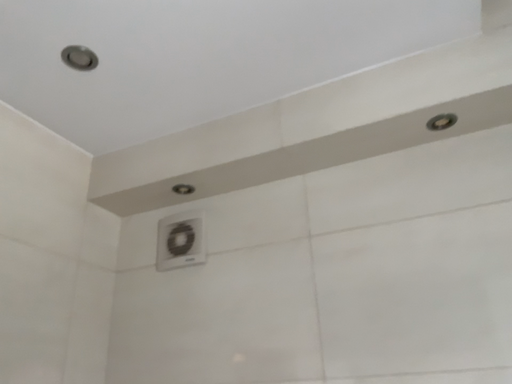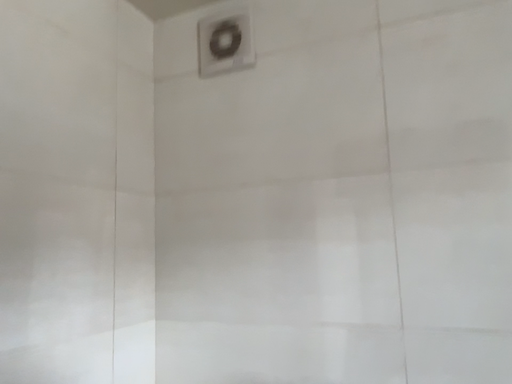
Question: How did the camera likely rotate when shooting the video?

Choices:
 (A) rotated downward
 (B) rotated upward

Answer: (A)